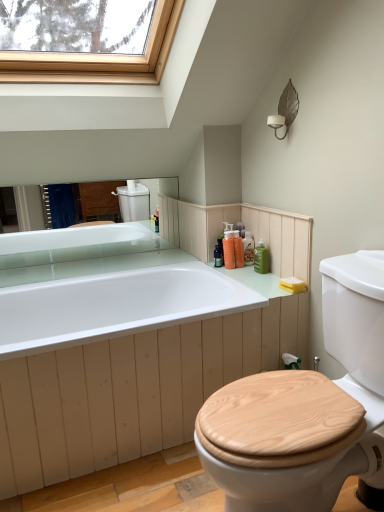
Question: From the image's perspective, is yellow sponge at right above or below translucent orange soap at upper right, which is counted as the 3th toiletry, starting from the right?

Choices:
 (A) above
 (B) below

Answer: (B)

Question: Is yellow sponge at right wider or thinner than translucent orange soap at upper right, which is counted as the 3th toiletry, starting from the right?

Choices:
 (A) wide
 (B) thin

Answer: (A)

Question: Estimate the real-world distances between objects in this image. Which object is closer to the yellow sponge at right?

Choices:
 (A) white glossy countertop at upper center
 (B) translucent orange soap at upper right, which is counted as the 3th toiletry, starting from the right
 (C) green plastic bottles at upper right, arranged as the fourth toiletry when viewed from the left
 (D) orange plastic bottle at upper right, which appears as the second toiletry when viewed from the right
 (E) translucent plastic bottles at upper right, marked as the 4th toiletry in a right-to-left arrangement

Answer: (C)

Question: Based on their relative distances, which object is nearer to the yellow sponge at right?

Choices:
 (A) green plastic bottles at upper right, arranged as the fourth toiletry when viewed from the left
 (B) orange plastic bottle at upper right, marked as the third toiletry in a left-to-right arrangement
 (C) translucent orange soap at upper right, positioned as the 2th toiletry in left-to-right order
 (D) translucent plastic bottles at upper right, marked as the 4th toiletry in a right-to-left arrangement
 (E) white glossy countertop at upper center

Answer: (A)